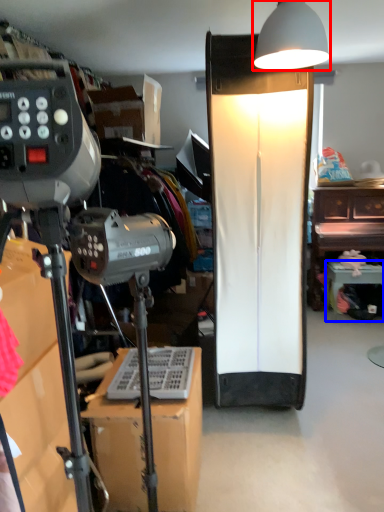
Question: Which point is further to the camera, lamp (highlighted by a red box) or furniture (highlighted by a blue box)?

Choices:
 (A) lamp
 (B) furniture

Answer: (B)